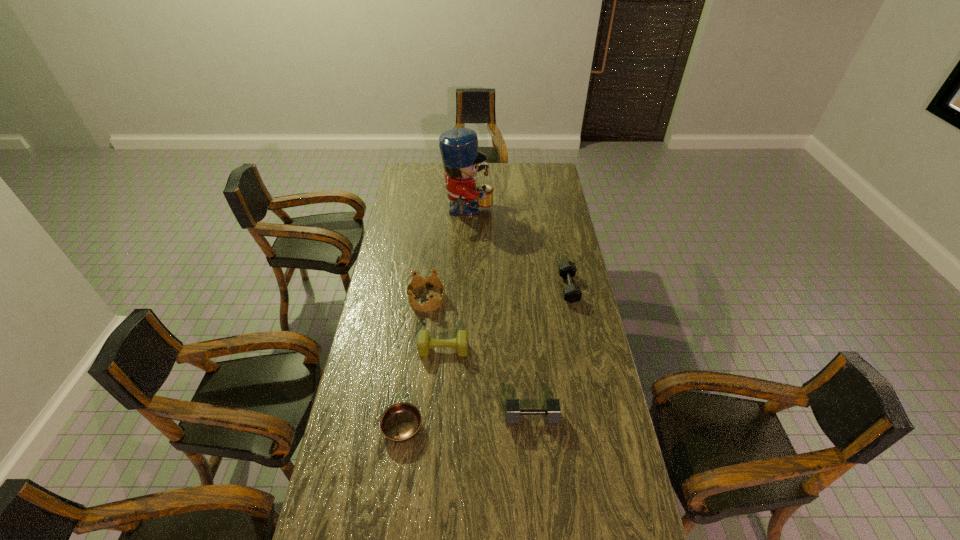
Where is `vacant space at the left edge`? vacant space at the left edge is located at coordinates (369, 358).

I want to click on vacant region at the right edge of the desktop, so click(571, 228).

At what (x,y) coordinates should I click in order to perform the action: click on blank region between the fifth shortest object and the rightmost object. Please return your answer as a coordinate pair (x, y). This screenshot has width=960, height=540. Looking at the image, I should click on (497, 293).

Find the location of a particular element. This screenshot has width=960, height=540. free point between the fifth object from left to right and the tallest object is located at coordinates (500, 315).

Where is `unoccupied position between the rightmost dumbbell and the nearest dumbbell`? Image resolution: width=960 pixels, height=540 pixels. unoccupied position between the rightmost dumbbell and the nearest dumbbell is located at coordinates (550, 353).

Find the location of a particular element. Image resolution: width=960 pixels, height=540 pixels. vacant space that's between the nutcracker and the fifth shortest object is located at coordinates (447, 255).

The image size is (960, 540). I want to click on free point between the farthest dumbbell and the tallest object, so click(518, 250).

You are a GUI agent. You are given a task and a screenshot of the screen. Output one action in this format:
    pyautogui.click(x=<x>, y=<y>)
    Task: Click on the free space between the second dumbbell from left to right and the shortest object
    The image size is (960, 540).
    Given the screenshot: What is the action you would take?
    pyautogui.click(x=467, y=423)

This screenshot has width=960, height=540. I want to click on empty location between the nearest dumbbell and the rightmost object, so click(x=550, y=353).

The width and height of the screenshot is (960, 540). In order to click on free spot between the rightmost object and the tallest object in this screenshot , I will do `click(518, 250)`.